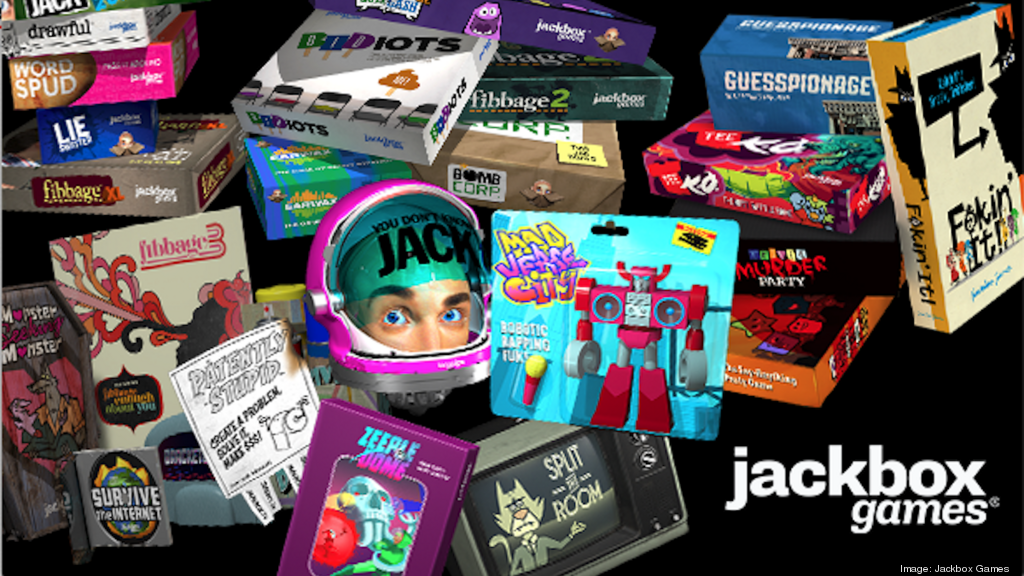
Locate an element on the screen. This screenshot has height=576, width=1024. television speaker is located at coordinates (657, 496).